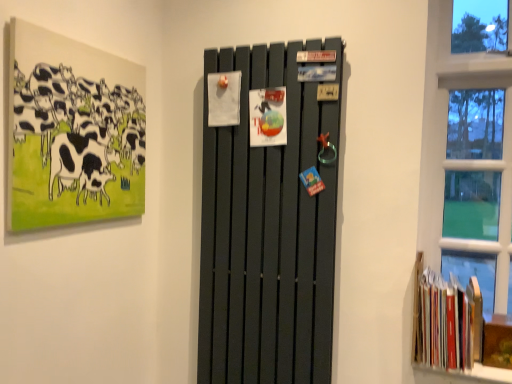
Question: From the image's perspective, is matte black painting of cows at upper left under matte black radiator at center?

Choices:
 (A) no
 (B) yes

Answer: (A)

Question: Considering the relative sizes of matte black painting of cows at upper left and matte black radiator at center in the image provided, is matte black painting of cows at upper left shorter than matte black radiator at center?

Choices:
 (A) no
 (B) yes

Answer: (B)

Question: From a real-world perspective, is matte black painting of cows at upper left located beneath matte black radiator at center?

Choices:
 (A) no
 (B) yes

Answer: (A)

Question: Is matte black painting of cows at upper left wider than matte black radiator at center?

Choices:
 (A) yes
 (B) no

Answer: (B)

Question: Can you confirm if matte black painting of cows at upper left is positioned to the left of matte black radiator at center?

Choices:
 (A) no
 (B) yes

Answer: (B)

Question: Is matte black painting of cows at upper left further to camera compared to matte black radiator at center?

Choices:
 (A) yes
 (B) no

Answer: (B)

Question: Considering the relative sizes of matte black radiator at center and hardcover books at lower right in the image provided, is matte black radiator at center bigger than hardcover books at lower right?

Choices:
 (A) yes
 (B) no

Answer: (A)

Question: Is matte black radiator at center at the right side of hardcover books at lower right?

Choices:
 (A) yes
 (B) no

Answer: (B)

Question: From a real-world perspective, does matte black radiator at center stand above hardcover books at lower right?

Choices:
 (A) yes
 (B) no

Answer: (A)

Question: Can you confirm if matte black radiator at center is thinner than hardcover books at lower right?

Choices:
 (A) no
 (B) yes

Answer: (B)

Question: From the image's perspective, does matte black radiator at center appear higher than hardcover books at lower right?

Choices:
 (A) yes
 (B) no

Answer: (A)

Question: Does matte black radiator at center appear on the left side of hardcover books at lower right?

Choices:
 (A) no
 (B) yes

Answer: (B)

Question: Is hardcover books at lower right surrounded by matte black painting of cows at upper left?

Choices:
 (A) yes
 (B) no

Answer: (B)